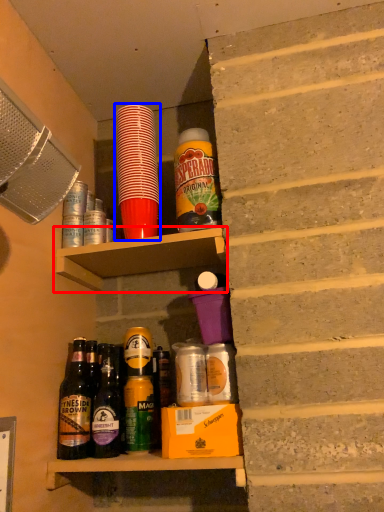
Question: Which object appears farthest to the camera in this image, shelf (highlighted by a red box) or bottle (highlighted by a blue box)?

Choices:
 (A) shelf
 (B) bottle

Answer: (B)